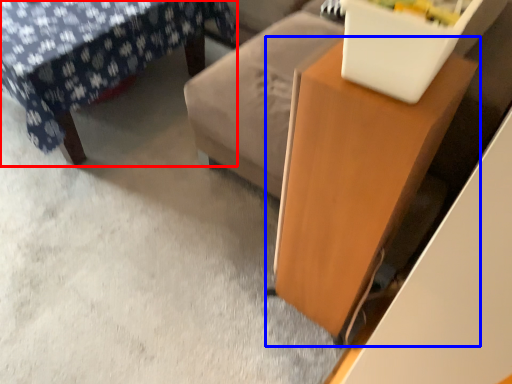
Question: Which point is closer to the camera, furniture (highlighted by a red box) or table (highlighted by a blue box)?

Choices:
 (A) furniture
 (B) table

Answer: (B)